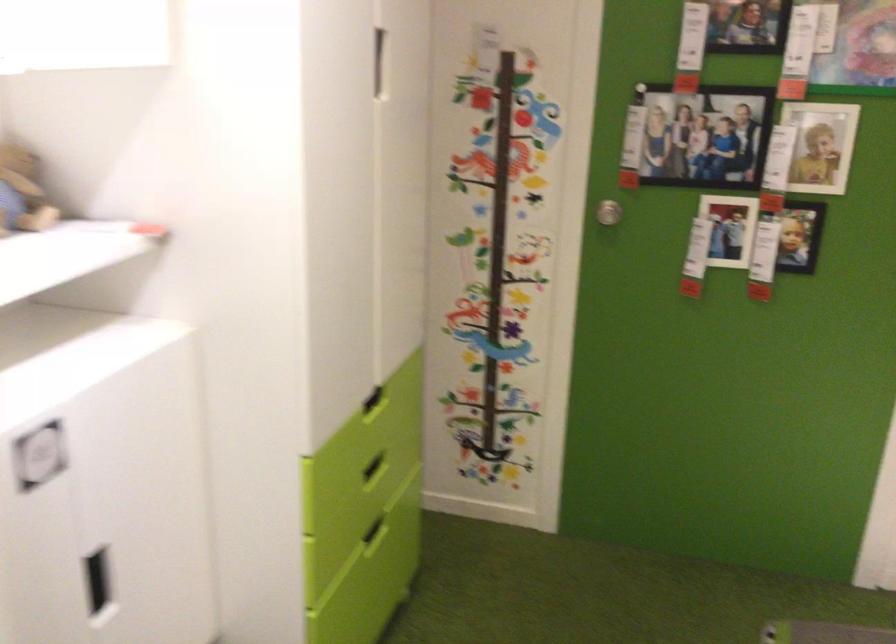
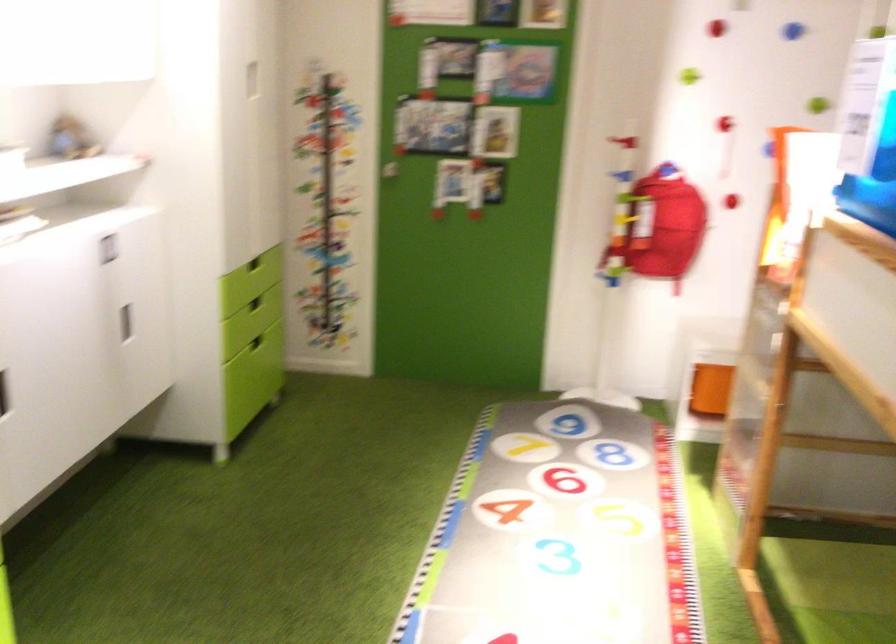
The point at (373, 532) is marked in the first image. Where is the corresponding point in the second image?

(255, 342)